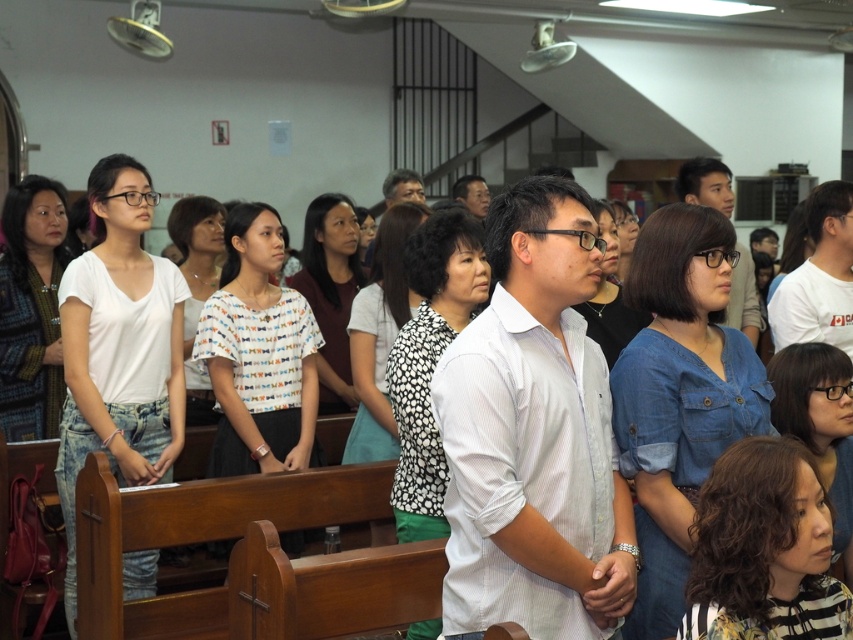
Question: Which of the following is the farthest from the observer?

Choices:
 (A) matte black shirt at center
 (B) white striped shirt at center

Answer: (A)

Question: Does white striped shirt at center come behind matte black shirt at center?

Choices:
 (A) yes
 (B) no

Answer: (B)

Question: Which object is positioned closest to the matte white shirt at center?

Choices:
 (A) white striped shirt at center
 (B) matte black shirt at center

Answer: (B)

Question: Can you confirm if white striped shirt at center is bigger than matte white shirt at center?

Choices:
 (A) no
 (B) yes

Answer: (A)

Question: Is white striped shirt at center wider than matte white shirt at center?

Choices:
 (A) yes
 (B) no

Answer: (A)

Question: Estimate the real-world distances between objects in this image. Which object is closer to the matte black shirt at center?

Choices:
 (A) white striped shirt at center
 (B) matte white shirt at center

Answer: (B)